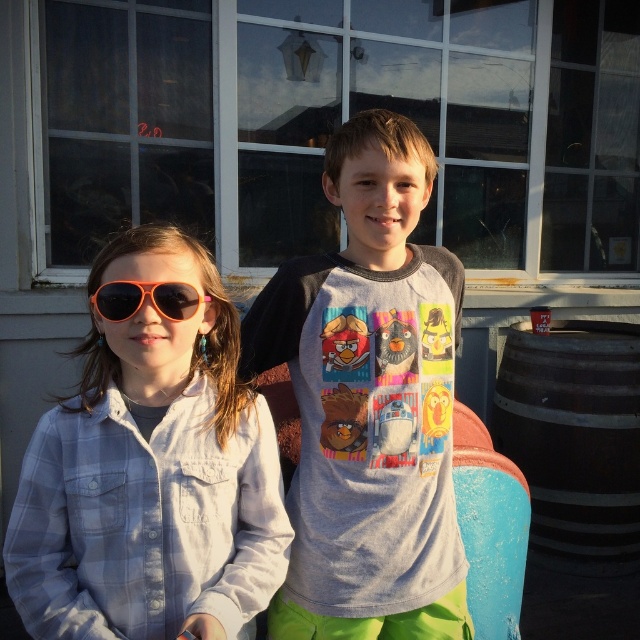
Question: Which of the following is the farthest from the observer?

Choices:
 (A) coord(552,509)
 (B) coord(154,300)
 (C) coord(460,269)
 (D) coord(67,502)

Answer: (A)

Question: From the image, what is the correct spatial relationship of brown wooden barrel at right in relation to orange reflective sunglasses at left?

Choices:
 (A) below
 (B) above

Answer: (A)

Question: Which object is farther from the camera taking this photo?

Choices:
 (A) brown wooden barrel at right
 (B) orange reflective sunglasses at left
 (C) matte orange sunglasses at left
 (D) gray cotton t-shirt at center

Answer: (A)

Question: Does matte orange sunglasses at left appear on the left side of orange reflective sunglasses at left?

Choices:
 (A) no
 (B) yes

Answer: (A)

Question: Which of the following is the farthest from the observer?

Choices:
 (A) gray cotton t-shirt at center
 (B) matte orange sunglasses at left

Answer: (A)

Question: Is gray cotton t-shirt at center closer to camera compared to brown wooden barrel at right?

Choices:
 (A) yes
 (B) no

Answer: (A)